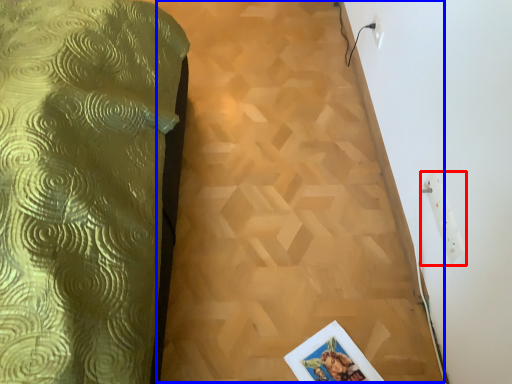
Question: Among these objects, which one is farthest to the camera, electric outlet (highlighted by a red box) or plywood (highlighted by a blue box)?

Choices:
 (A) electric outlet
 (B) plywood

Answer: (B)